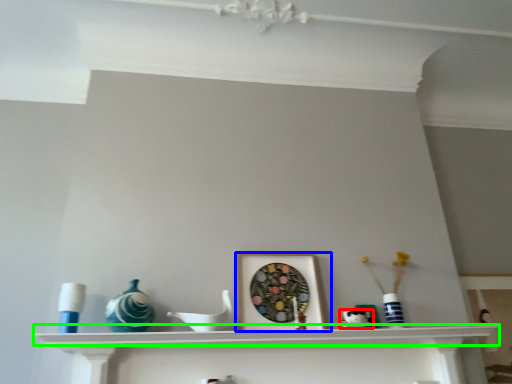
Question: Which is farther away from art (highlighted by a red box)? picture frame (highlighted by a blue box) or shelf (highlighted by a green box)?

Choices:
 (A) picture frame
 (B) shelf

Answer: (B)